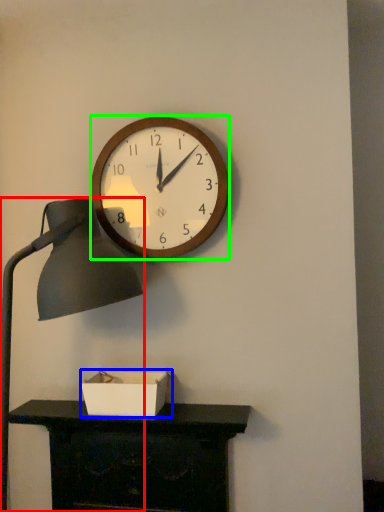
Question: Which object is the closest to the lamp (highlighted by a red box)? Choose among these: box (highlighted by a blue box) or wall clock (highlighted by a green box).

Choices:
 (A) box
 (B) wall clock

Answer: (B)